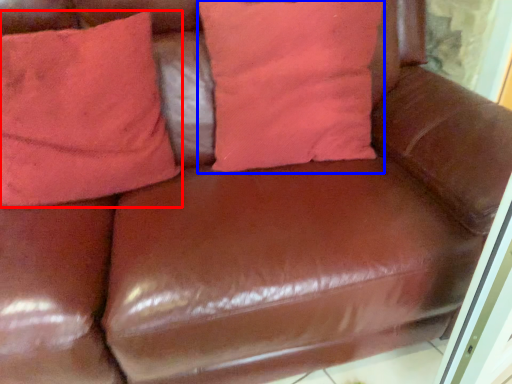
Question: Among these objects, which one is nearest to the camera, pillow (highlighted by a red box) or pillow (highlighted by a blue box)?

Choices:
 (A) pillow
 (B) pillow

Answer: (A)